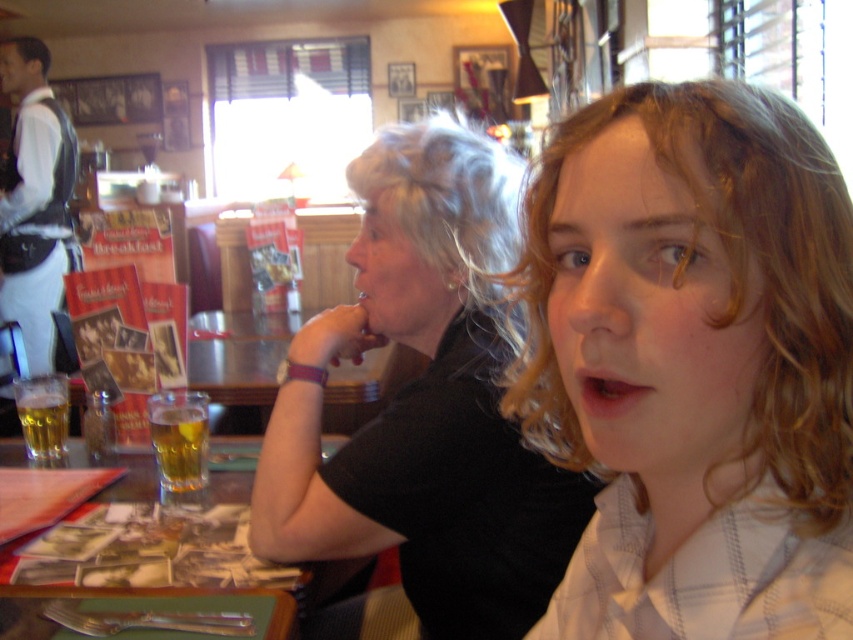
Is point (676, 168) positioned after point (59, 426)?

No, it is not.

Who is more distant from viewer, (743, 410) or (57, 428)?

The point (57, 428) is behind.

At what (x,y) coordinates should I click in order to perform the action: click on blonde hair at center. Please return your answer as a coordinate pair (x, y). The image size is (853, 640). Looking at the image, I should click on (693, 364).

Find the location of `blonde hair at center`. blonde hair at center is located at coordinates (693, 364).

Is wooden table at center positioned behind translucent glass beverage at table front?

No, it is in front of translucent glass beverage at table front.

Locate an element on the screen. This screenshot has width=853, height=640. wooden table at center is located at coordinates (322, 589).

Is blonde hair at center smaller than translucent glass beverage at table front?

Actually, blonde hair at center might be larger than translucent glass beverage at table front.

From the picture: Can you confirm if blonde hair at center is positioned to the right of translucent glass beverage at table front?

Indeed, blonde hair at center is positioned on the right side of translucent glass beverage at table front.

Is point (618, 372) positioned behind point (171, 426)?

That is False.

This screenshot has height=640, width=853. I want to click on blonde hair at center, so click(x=693, y=364).